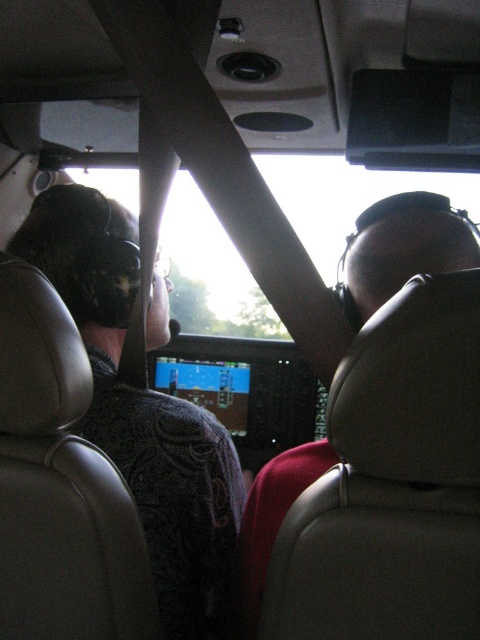
Consider the image. Does matte black helmet at left have a greater height compared to matte black helmet at right?

Correct, matte black helmet at left is much taller as matte black helmet at right.

Does point (236, 461) come behind point (389, 198)?

Yes, it is behind point (389, 198).

This screenshot has height=640, width=480. I want to click on matte black helmet at left, so click(142, 410).